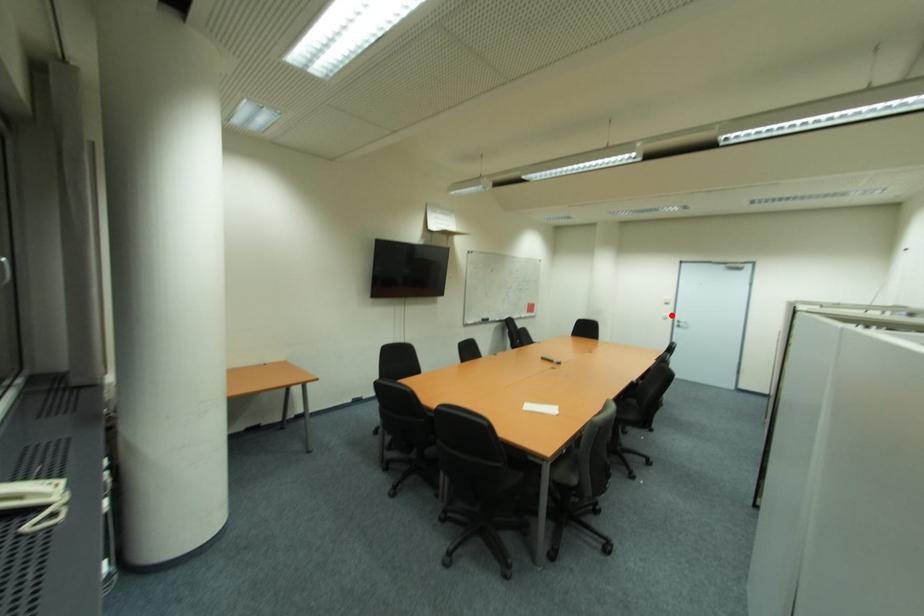
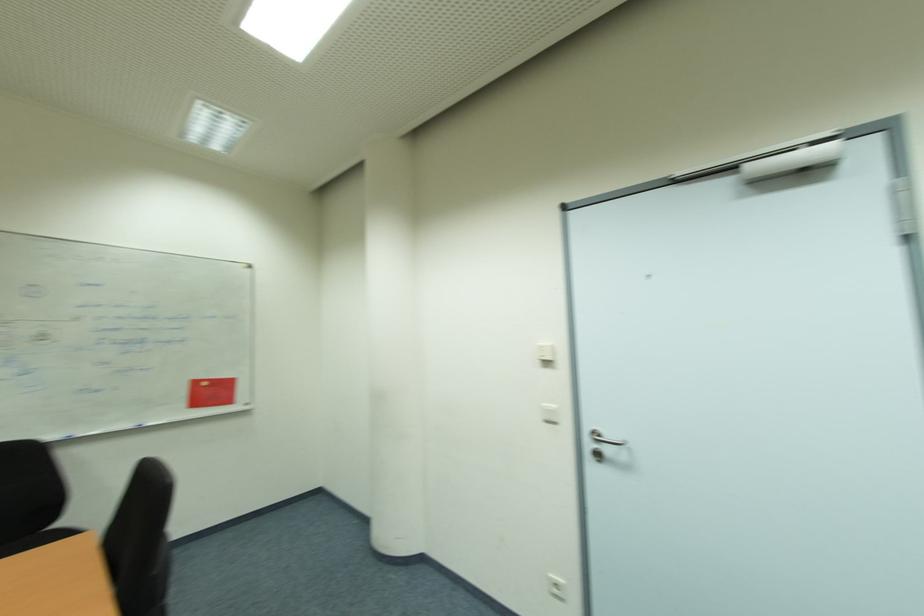
In the second image, find the point that corresponds to the highlighted location in the first image.

(556, 407)